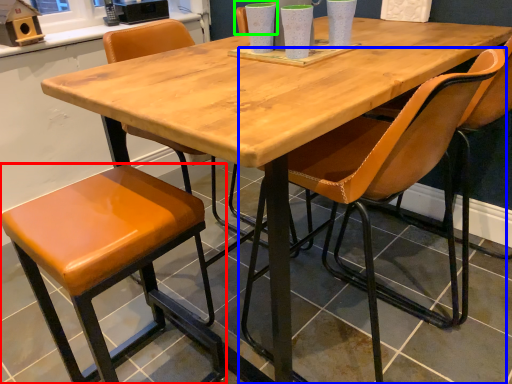
Question: Which object is the farthest from stool (highlighted by a red box)? Choose among these: chair (highlighted by a blue box) or chair (highlighted by a green box).

Choices:
 (A) chair
 (B) chair

Answer: (B)